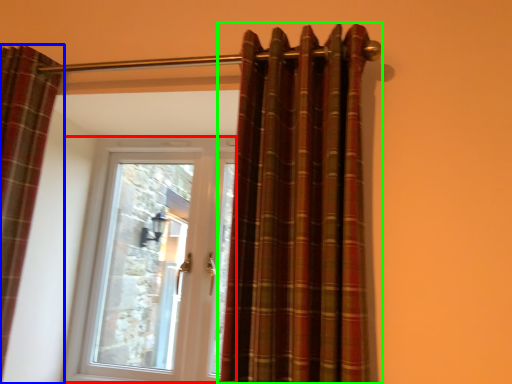
Question: Which is farther away from door (highlighted by a red box)? curtain (highlighted by a blue box) or curtain (highlighted by a green box)?

Choices:
 (A) curtain
 (B) curtain

Answer: (B)